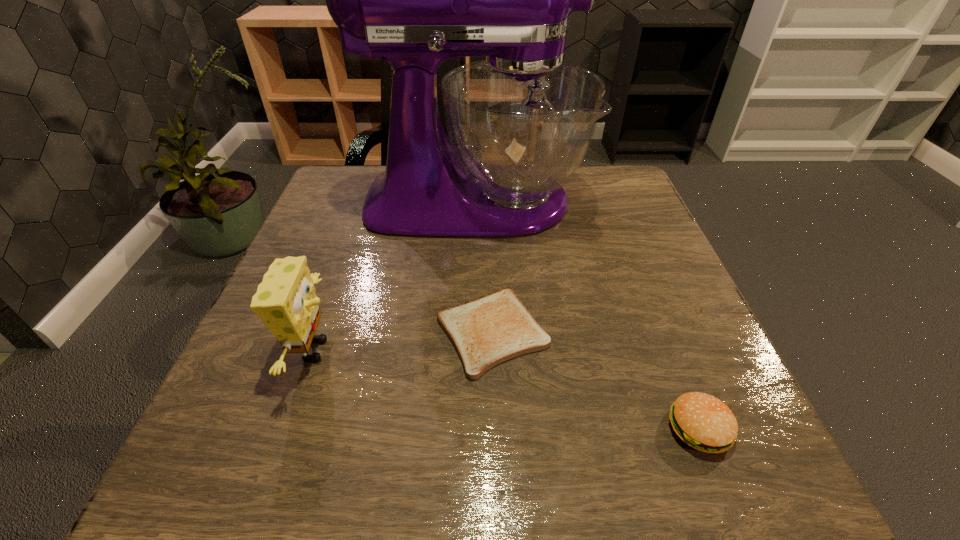
The height and width of the screenshot is (540, 960). What are the coordinates of `vacant region between the farthest object and the shortest object` in the screenshot? It's located at (483, 267).

Find the location of a particular element. This screenshot has width=960, height=540. empty space between the farthest object and the patty is located at coordinates (587, 315).

Where is `unoccupied area between the toast and the third shortest object`? This screenshot has width=960, height=540. unoccupied area between the toast and the third shortest object is located at coordinates (403, 341).

Locate an element on the screen. This screenshot has height=540, width=960. object that is the third closest one to the rightmost object is located at coordinates (285, 300).

Find the location of a particular element. This screenshot has height=540, width=960. the third closest object to the third shortest object is located at coordinates (702, 421).

I want to click on vacant region that satisfies the following two spatial constraints: 1. on the front side of the toast; 2. on the left side of the patty, so click(494, 428).

The height and width of the screenshot is (540, 960). What are the coordinates of `free location that satisfies the following two spatial constraints: 1. at the bowl opening of the rightmost object; 2. on the right side of the farthest object` in the screenshot? It's located at (470, 428).

This screenshot has width=960, height=540. I want to click on vacant area that satisfies the following two spatial constraints: 1. at the bowl opening of the mixer; 2. on the left side of the toast, so click(472, 332).

This screenshot has width=960, height=540. In order to click on free space that satisfies the following two spatial constraints: 1. at the bowl opening of the second shortest object; 2. on the right side of the farthest object in this screenshot , I will do `click(470, 428)`.

This screenshot has height=540, width=960. Identify the location of free space that satisfies the following two spatial constraints: 1. at the bowl opening of the tallest object; 2. on the right side of the second shortest object. (470, 428).